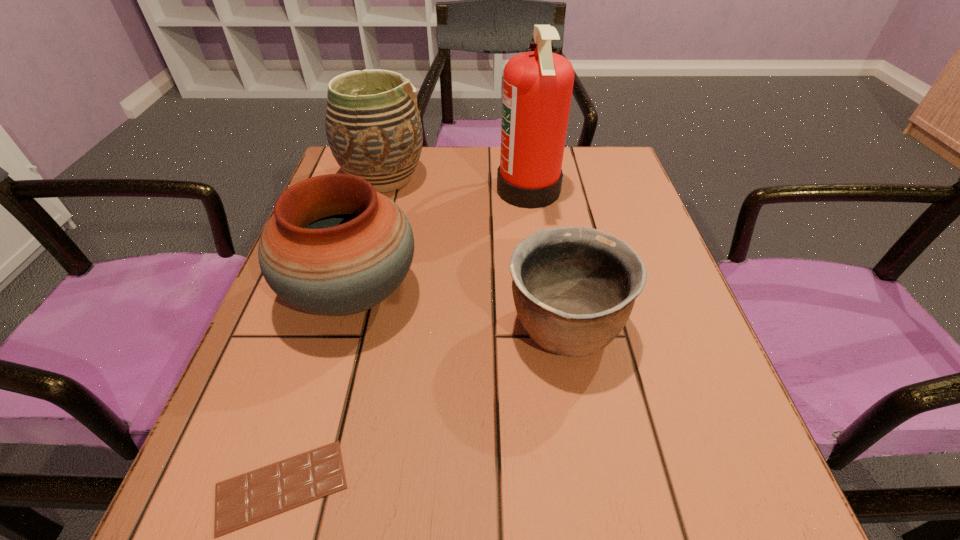
At what (x,y) coordinates should I click in order to perform the action: click on the tallest object. Please return your answer as a coordinate pair (x, y). The image size is (960, 540). Looking at the image, I should click on (537, 85).

Where is `the farthest pottery`? Image resolution: width=960 pixels, height=540 pixels. the farthest pottery is located at coordinates (373, 127).

This screenshot has height=540, width=960. I want to click on the second shortest pottery, so click(334, 246).

Locate an element on the screen. The height and width of the screenshot is (540, 960). the shortest pottery is located at coordinates (574, 288).

Image resolution: width=960 pixels, height=540 pixels. Identify the location of the fourth tallest object. (574, 288).

Where is `the shortest object`? The image size is (960, 540). the shortest object is located at coordinates (243, 500).

The image size is (960, 540). In order to click on chocolate bar in this screenshot , I will do `click(243, 500)`.

This screenshot has width=960, height=540. Find the location of `vacant space located at the nozzle of the fire extinguisher`. vacant space located at the nozzle of the fire extinguisher is located at coordinates (383, 190).

At what (x,y) coordinates should I click in order to perform the action: click on vacant area located at the nozzle of the fire extinguisher. Please return your answer as a coordinate pair (x, y). This screenshot has height=540, width=960. Looking at the image, I should click on (388, 190).

Find the location of a particular element. This screenshot has height=540, width=960. vacant space located 0.350m at the nozzle of the fire extinguisher is located at coordinates (349, 190).